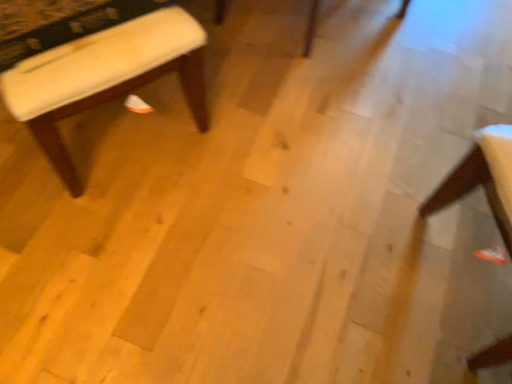
Question: Relative to white fabric stool at left, is white fabric chair at lower right in front or behind?

Choices:
 (A) behind
 (B) front

Answer: (B)

Question: In terms of height, does white fabric chair at lower right look taller or shorter compared to white fabric stool at left?

Choices:
 (A) tall
 (B) short

Answer: (B)

Question: Considering the positions of white fabric chair at lower right and white fabric stool at left in the image, is white fabric chair at lower right wider or thinner than white fabric stool at left?

Choices:
 (A) wide
 (B) thin

Answer: (B)

Question: Which is correct: white fabric stool at left is inside white fabric chair at lower right, or outside of it?

Choices:
 (A) inside
 (B) outside

Answer: (B)

Question: Is point (139, 36) closer or farther from the camera than point (495, 144)?

Choices:
 (A) farther
 (B) closer

Answer: (A)

Question: In terms of width, does white fabric stool at left look wider or thinner when compared to white fabric chair at lower right?

Choices:
 (A) wide
 (B) thin

Answer: (A)

Question: In terms of size, does white fabric stool at left appear bigger or smaller than white fabric chair at lower right?

Choices:
 (A) small
 (B) big

Answer: (B)